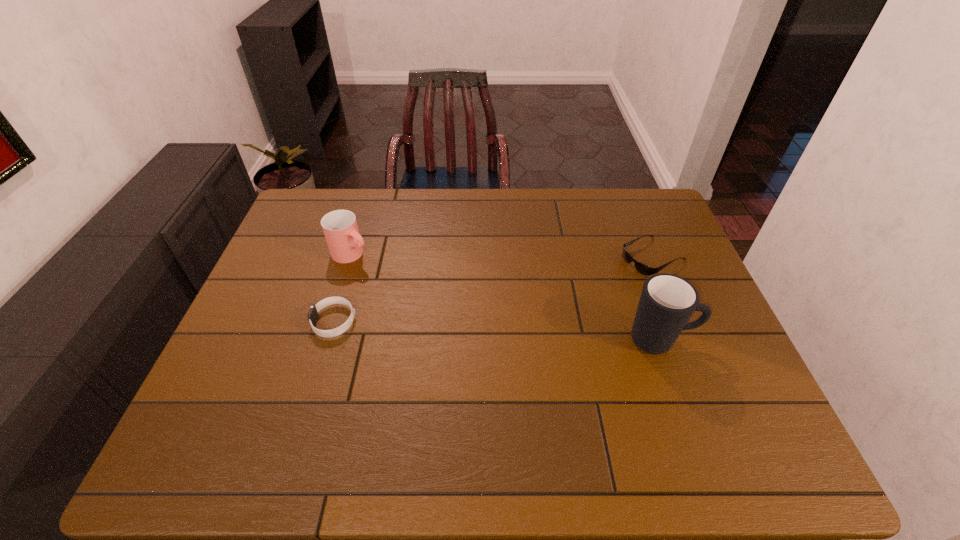
In the image, there is a desktop. Where is `vacant space at the near right corner`? This screenshot has width=960, height=540. vacant space at the near right corner is located at coordinates (730, 402).

Where is `free space between the wristband and the sunglasses`? free space between the wristband and the sunglasses is located at coordinates (x=493, y=289).

Where is `free point between the wristband and the mug`? The image size is (960, 540). free point between the wristband and the mug is located at coordinates (498, 330).

Find the location of a particular element. vacant point located between the cup and the mug is located at coordinates (507, 297).

Locate an element on the screen. The image size is (960, 540). free space between the sunglasses and the wristband is located at coordinates (493, 289).

I want to click on vacant area that lies between the second tallest object and the sunglasses, so click(x=502, y=255).

In order to click on free space that is in between the cup and the sunglasses in this screenshot , I will do `click(502, 255)`.

The height and width of the screenshot is (540, 960). I want to click on free space that is in between the sunglasses and the third shortest object, so click(x=502, y=255).

Where is `free space between the third shortest object and the wristband`? This screenshot has height=540, width=960. free space between the third shortest object and the wristband is located at coordinates (343, 288).

Where is `free space between the cup and the wristband`? This screenshot has width=960, height=540. free space between the cup and the wristband is located at coordinates (343, 288).